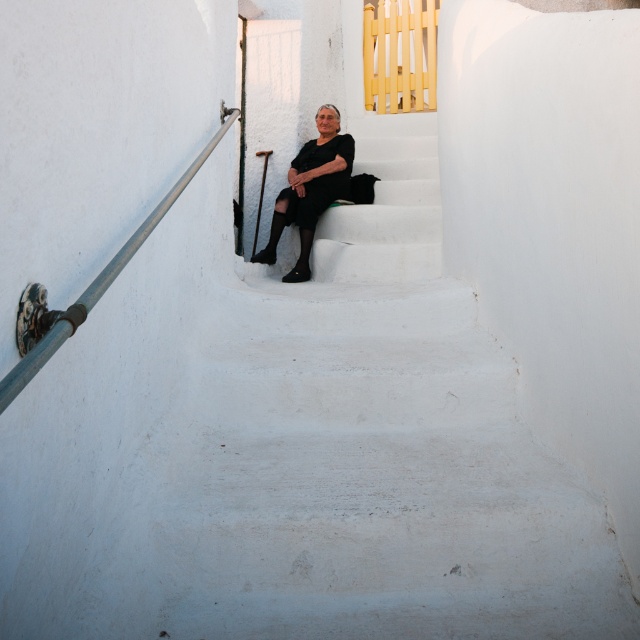
Is white matte stairs at center smaller than metallic gray handrail at left?

Actually, white matte stairs at center might be larger than metallic gray handrail at left.

I want to click on white matte stairs at center, so click(x=387, y=205).

In order to click on white matte stairs at center in this screenshot , I will do `click(387, 205)`.

Can you confirm if white matte stairs at center is positioned below black matte dress at center?

Correct, white matte stairs at center is located below black matte dress at center.

Is white matte stairs at center positioned at the back of black matte dress at center?

No, white matte stairs at center is in front of black matte dress at center.

Who is more distant from viewer, [348,244] or [264,252]?

Positioned behind is point [264,252].

Identify the location of white matte stairs at center. The height and width of the screenshot is (640, 640). (387, 205).

Which is in front, point (282, 218) or point (164, 211)?

Point (164, 211)

Who is more forward, (308, 211) or (29, 353)?

Point (29, 353)

Identify the location of black matte dress at center. (310, 189).